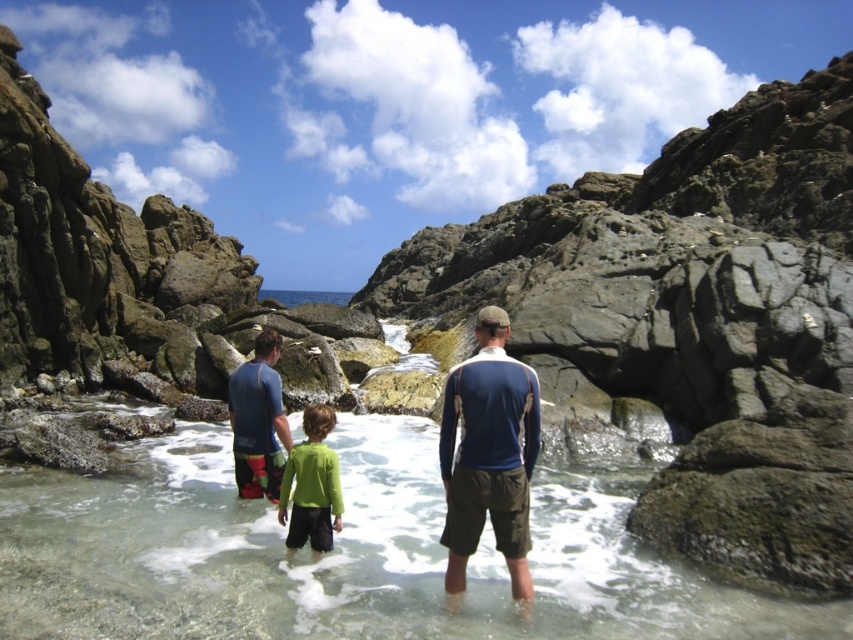
Based on the photo, is clear water at center thinner than blue/white long-sleeved shirt at center?

In fact, clear water at center might be wider than blue/white long-sleeved shirt at center.

Is the position of clear water at center more distant than that of blue/white long-sleeved shirt at center?

No, it is in front of blue/white long-sleeved shirt at center.

What do you see at coordinates (344, 554) in the screenshot? This screenshot has width=853, height=640. I see `clear water at center` at bounding box center [344, 554].

Find the location of `clear water at center`. clear water at center is located at coordinates (344, 554).

Between blue wetsuit at center and green matte shirt at center, which one appears on the right side from the viewer's perspective?

Positioned to the right is green matte shirt at center.

Between blue wetsuit at center and green matte shirt at center, which one is positioned higher?

blue wetsuit at center

Is point (229, 406) in front of point (309, 518)?

That is False.

Identify the location of blue wetsuit at center. The height and width of the screenshot is (640, 853). (258, 420).

Is clear water at center shorter than blue wetsuit at center?

Indeed, clear water at center has a lesser height compared to blue wetsuit at center.

Measure the distance between clear water at center and camera.

The distance of clear water at center from camera is 27.12 meters.

Locate an element on the screen. clear water at center is located at coordinates (344, 554).